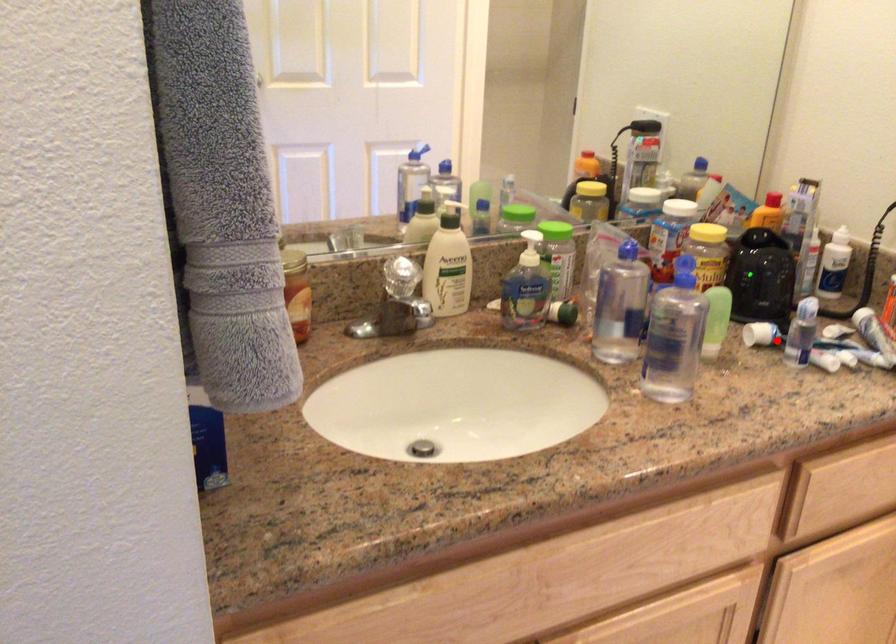
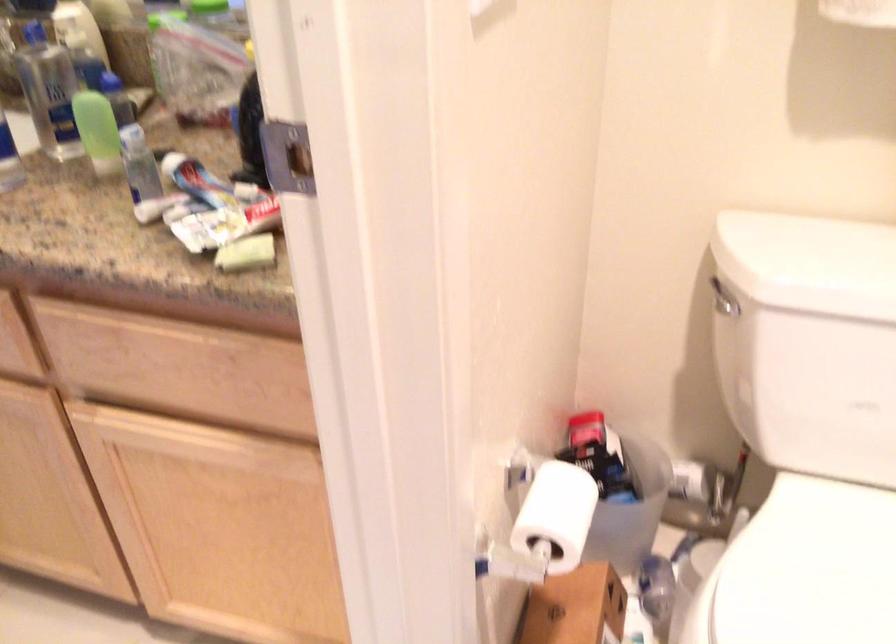
Question: I am providing you with two images of the same scene from different viewpoints. A red point is shown in image1. For the corresponding object point in image2, is it positioned nearer or farther from the camera?

Choices:
 (A) Nearer
 (B) Farther

Answer: (A)